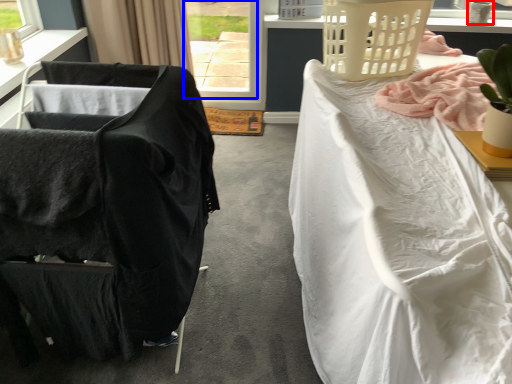
Question: Among these objects, which one is farthest to the camera, lamp (highlighted by a red box) or window (highlighted by a blue box)?

Choices:
 (A) lamp
 (B) window

Answer: (B)